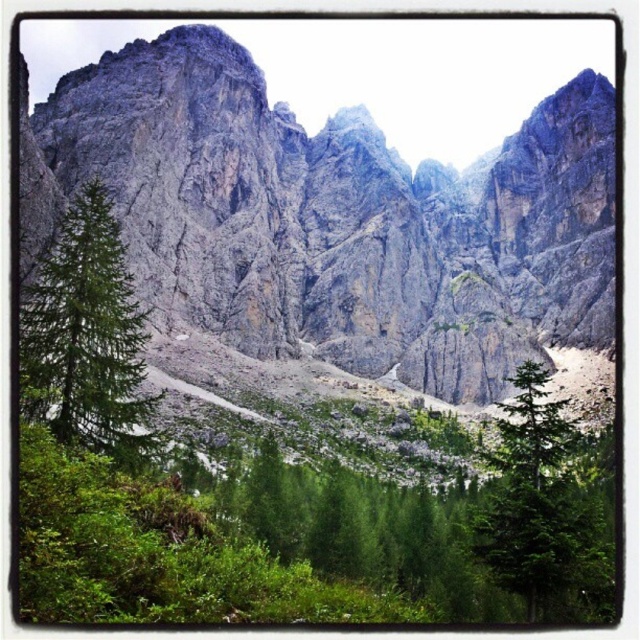
Between green matte tree at lower left and green matte tree at lower right, which one is positioned lower?

green matte tree at lower right is lower down.

Who is higher up, green matte tree at lower left or green matte tree at lower right?

green matte tree at lower left

Does point (72, 211) come farther from viewer compared to point (531, 541)?

Yes, point (72, 211) is behind point (531, 541).

You are a GUI agent. You are given a task and a screenshot of the screen. Output one action in this format:
    pyautogui.click(x=<x>, y=<y>)
    Task: Click on the green matte tree at lower left
    
    Given the screenshot: What is the action you would take?
    click(x=88, y=339)